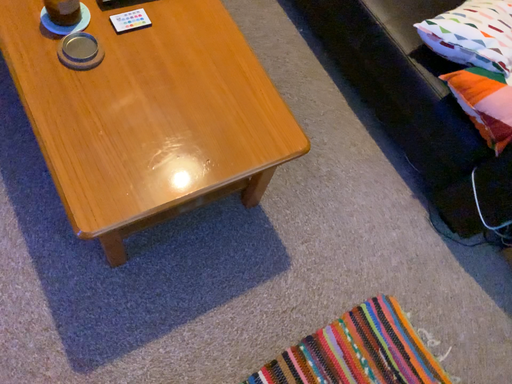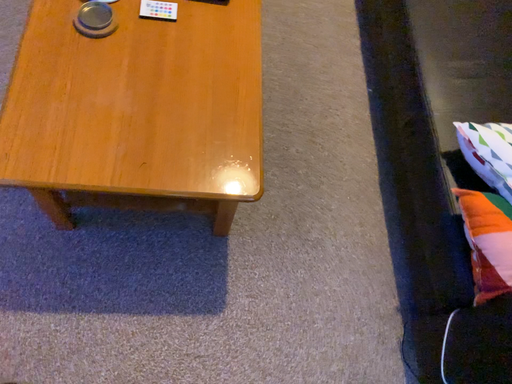
Question: Which way did the camera rotate in the video?

Choices:
 (A) rotated left
 (B) rotated right

Answer: (A)